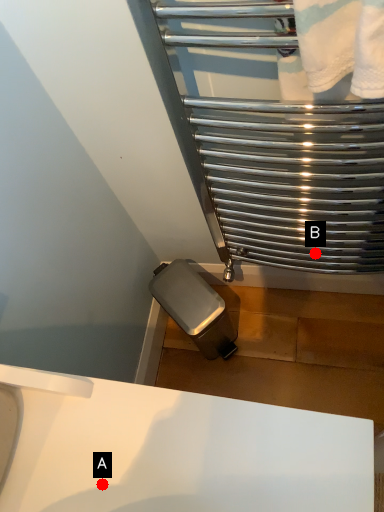
Question: Two points are circled on the image, labeled by A and B beside each circle. Which point appears closest to the camera in this image?

Choices:
 (A) A is closer
 (B) B is closer

Answer: (A)